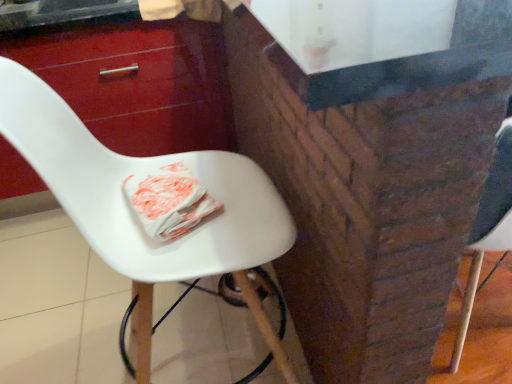
Question: From a real-world perspective, is glossy wood drawer at upper left on top of white plastic chair at center?

Choices:
 (A) yes
 (B) no

Answer: (B)

Question: Is glossy wood drawer at upper left further to the viewer compared to white plastic chair at center?

Choices:
 (A) no
 (B) yes

Answer: (B)

Question: Can you confirm if glossy wood drawer at upper left is positioned to the right of white plastic chair at center?

Choices:
 (A) no
 (B) yes

Answer: (A)

Question: From the image's perspective, would you say glossy wood drawer at upper left is shown under white plastic chair at center?

Choices:
 (A) no
 (B) yes

Answer: (A)

Question: Does glossy wood drawer at upper left have a larger size compared to white plastic chair at center?

Choices:
 (A) yes
 (B) no

Answer: (A)

Question: Considering the relative sizes of glossy wood drawer at upper left and white plastic chair at center in the image provided, is glossy wood drawer at upper left smaller than white plastic chair at center?

Choices:
 (A) no
 (B) yes

Answer: (A)

Question: Considering the relative positions of white plastic chair at center and glossy wood drawer at upper left in the image provided, is white plastic chair at center to the left of glossy wood drawer at upper left from the viewer's perspective?

Choices:
 (A) yes
 (B) no

Answer: (B)

Question: Is glossy wood drawer at upper left located within white plastic chair at center?

Choices:
 (A) yes
 (B) no

Answer: (B)

Question: Is white plastic chair at center turned away from glossy wood drawer at upper left?

Choices:
 (A) no
 (B) yes

Answer: (A)

Question: Does white plastic chair at center have a greater height compared to glossy wood drawer at upper left?

Choices:
 (A) no
 (B) yes

Answer: (B)

Question: Is white plastic chair at center completely or partially outside of glossy wood drawer at upper left?

Choices:
 (A) no
 (B) yes

Answer: (B)

Question: From a real-world perspective, is white plastic chair at center located beneath glossy wood drawer at upper left?

Choices:
 (A) yes
 (B) no

Answer: (B)

Question: Considering the relative positions of white plastic chair at center and glossy wood drawer at upper left in the image provided, is white plastic chair at center to the left or to the right of glossy wood drawer at upper left?

Choices:
 (A) right
 (B) left

Answer: (A)